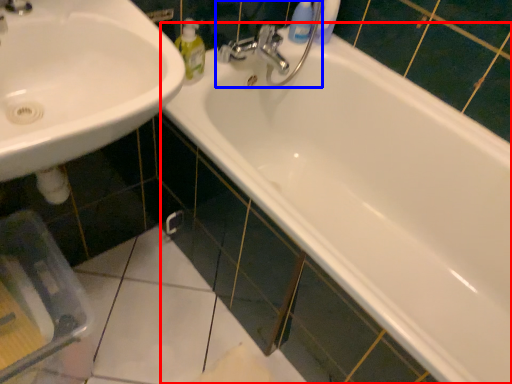
Question: Which object appears closest to the camera in this image, bathtub (highlighted by a red box) or plumbing fixture (highlighted by a blue box)?

Choices:
 (A) bathtub
 (B) plumbing fixture

Answer: (A)